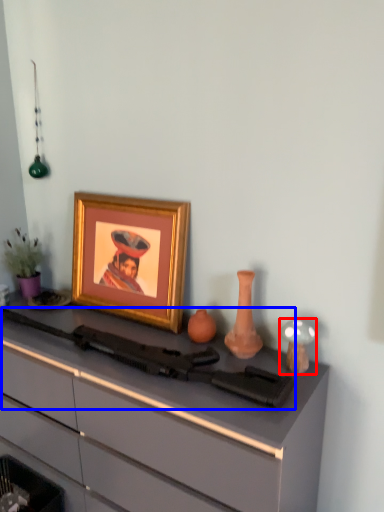
Question: Among these objects, which one is nearest to the camera, candle holder (highlighted by a red box) or rifle (highlighted by a blue box)?

Choices:
 (A) candle holder
 (B) rifle

Answer: (B)